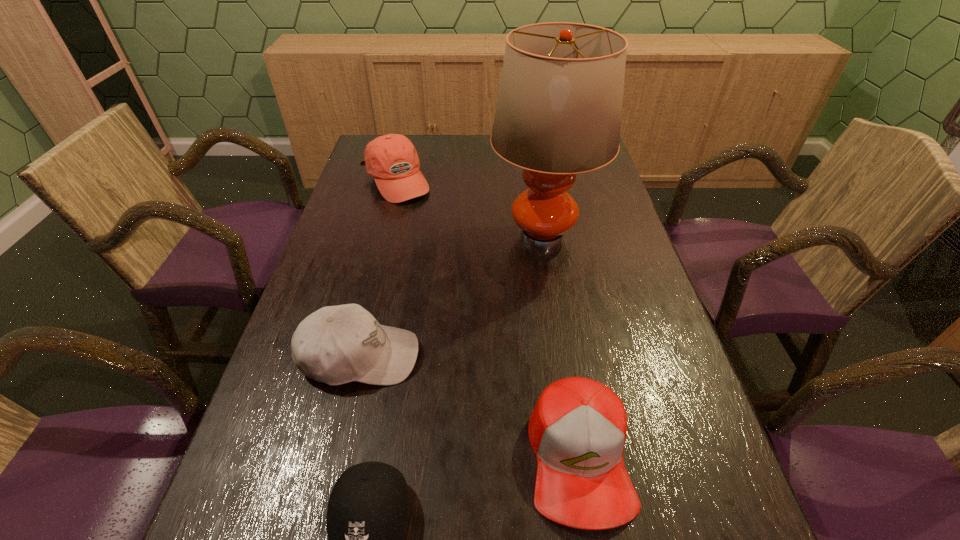
Where is `vacant space that's between the lamp and the rightmost baseball cap`? vacant space that's between the lamp and the rightmost baseball cap is located at coordinates (561, 346).

You are a GUI agent. You are given a task and a screenshot of the screen. Output one action in this format:
    pyautogui.click(x=<x>, y=<y>)
    Task: Click on the closest object to the third farthest object
    This screenshot has width=960, height=540.
    Given the screenshot: What is the action you would take?
    pyautogui.click(x=368, y=509)

Locate which object ranks fourth in proximity to the rightmost baseball cap. Please provide its 2D coordinates. Your answer should be formatted as a tuple, i.e. [(x, y)], where the tuple contains the x and y coordinates of a point satisfying the conditions above.

[(392, 159)]

Where is `baseball cap that is the third nearest to the farthest baseball cap`? The image size is (960, 540). baseball cap that is the third nearest to the farthest baseball cap is located at coordinates (368, 509).

Identify which baseball cap is the third closest to the farthest baseball cap. Please provide its 2D coordinates. Your answer should be formatted as a tuple, i.e. [(x, y)], where the tuple contains the x and y coordinates of a point satisfying the conditions above.

[(368, 509)]